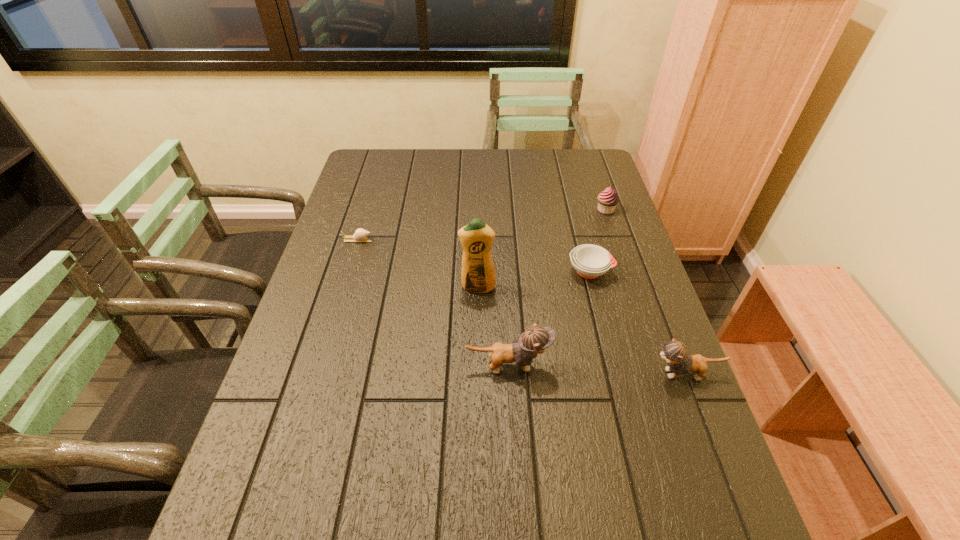
Find the location of a particular element. kitten positioned at the right edge is located at coordinates (675, 352).

Identify the location of cupcake that is at the right edge. (607, 200).

Find the location of a particular element. This screenshot has width=960, height=540. soup bowl present at the right edge is located at coordinates (590, 261).

Locate an element on the screen. The height and width of the screenshot is (540, 960). vacant point at the far edge is located at coordinates (534, 155).

Image resolution: width=960 pixels, height=540 pixels. I want to click on vacant point at the left edge, so click(345, 194).

In order to click on vacant space at the right edge in this screenshot , I will do `click(660, 349)`.

In the image, there is a desktop. At what (x,y) coordinates should I click in order to perform the action: click on vacant space at the far left corner. Please return your answer as a coordinate pair (x, y). The height and width of the screenshot is (540, 960). Looking at the image, I should click on (356, 167).

Locate an element on the screen. Image resolution: width=960 pixels, height=540 pixels. blank space at the far right corner is located at coordinates (587, 183).

Locate an element on the screen. vacant space at the near right corner of the desktop is located at coordinates (704, 496).

At what (x,y) coordinates should I click in order to perform the action: click on unoccupied area between the shorter kitten and the second farthest object. Please return your answer as a coordinate pair (x, y). The height and width of the screenshot is (540, 960). Looking at the image, I should click on coord(521,307).